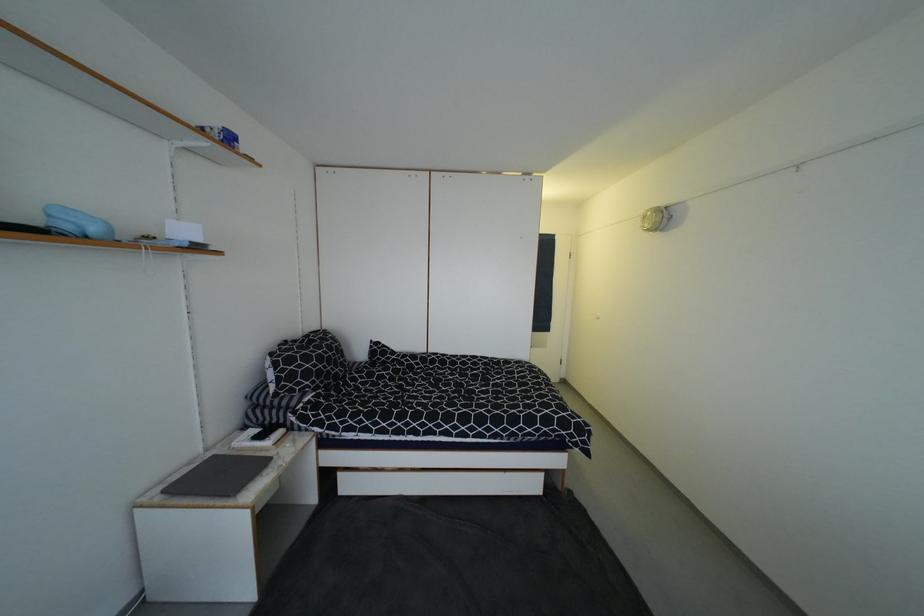
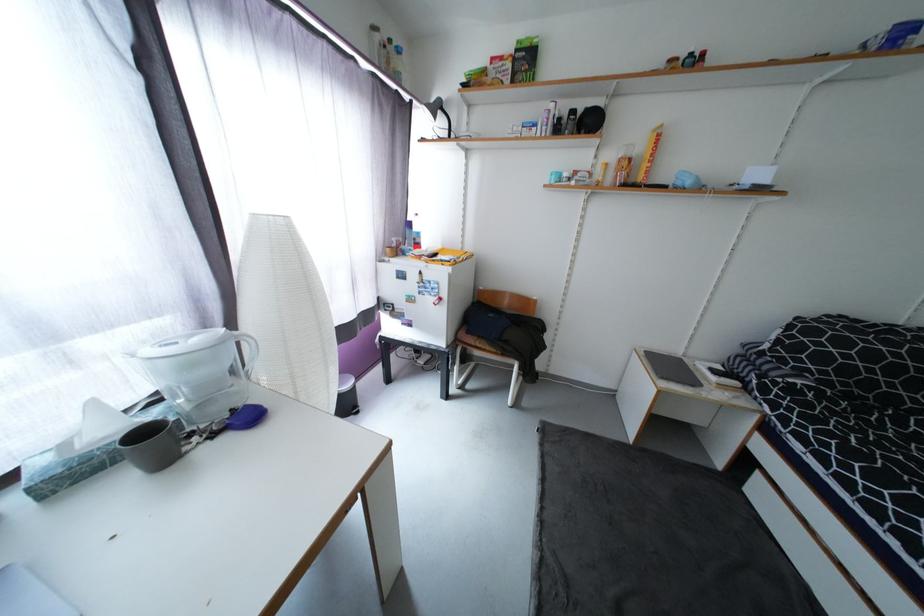
In the scene shown: First-person continuous shooting, in which direction is the camera rotating?

The rotation direction of the camera is left-down.